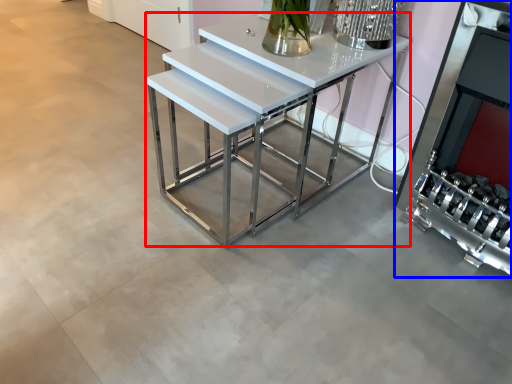
Question: Among these objects, which one is farthest to the camera, table (highlighted by a red box) or fireplace (highlighted by a blue box)?

Choices:
 (A) table
 (B) fireplace

Answer: (A)